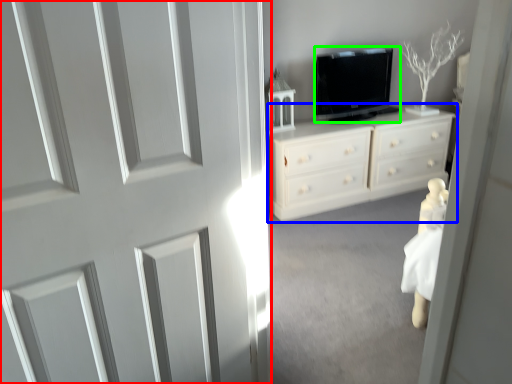
Question: Estimate the real-world distances between objects in this image. Which object is closer to door (highlighted by a red box), chest of drawers (highlighted by a blue box) or television (highlighted by a green box)?

Choices:
 (A) chest of drawers
 (B) television

Answer: (A)